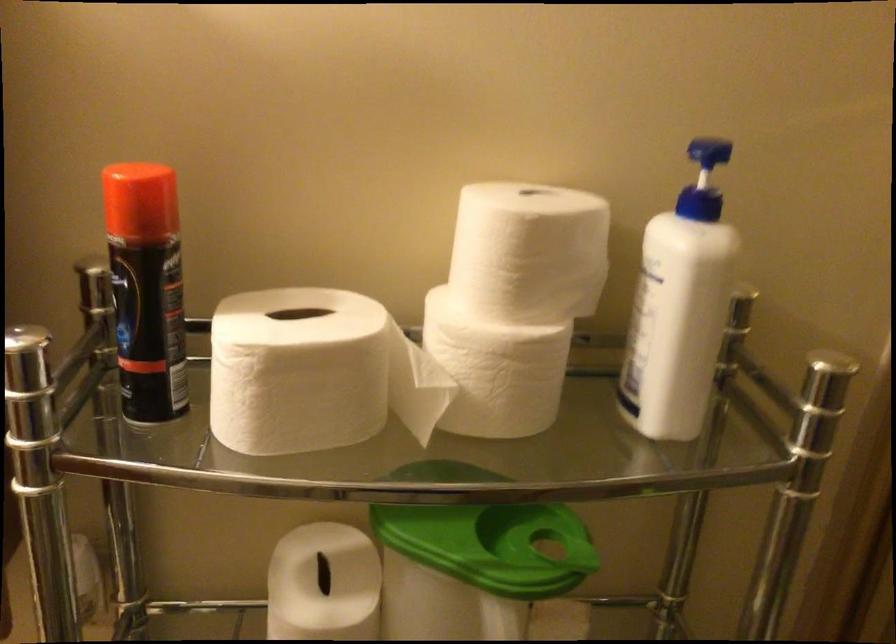
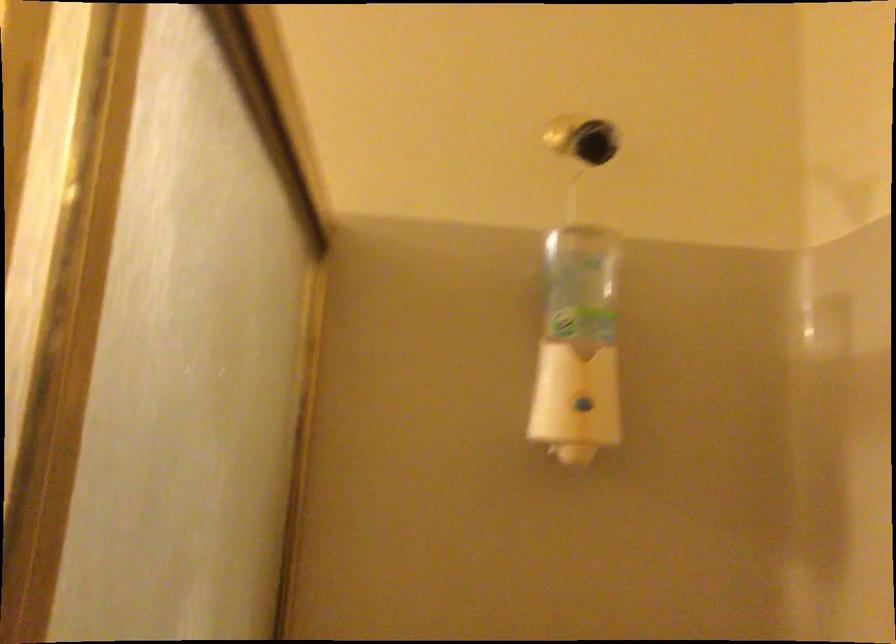
Question: How did the camera likely rotate?

Choices:
 (A) Left
 (B) Right
 (C) Up
 (D) Down

Answer: (C)